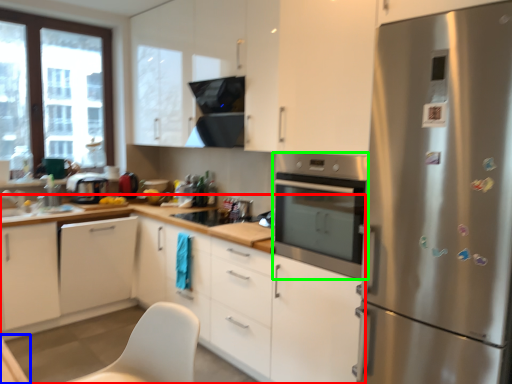
Question: Which is farther away from cabinetry (highlighted by a red box)? table (highlighted by a blue box) or home appliance (highlighted by a green box)?

Choices:
 (A) table
 (B) home appliance

Answer: (A)